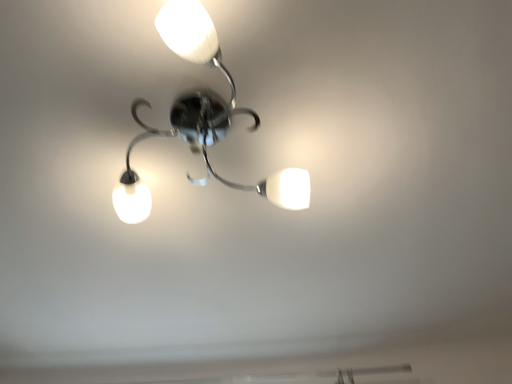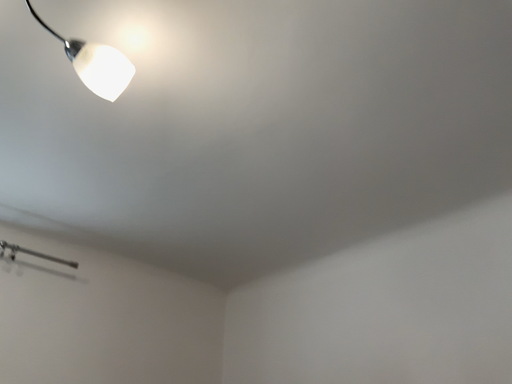
Question: Which way did the camera rotate in the video?

Choices:
 (A) rotated upward
 (B) rotated downward

Answer: (B)